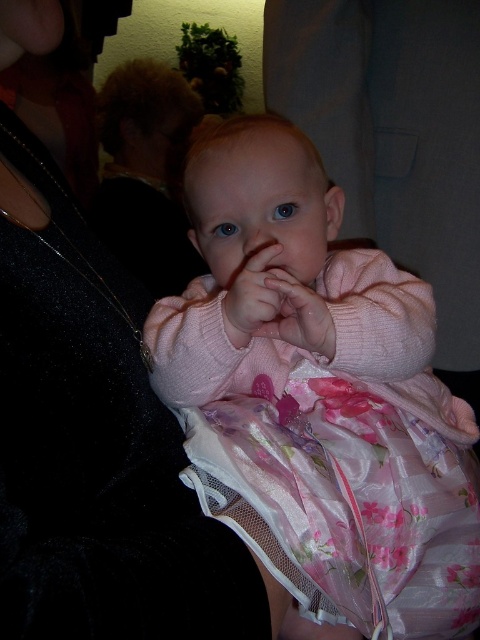
Question: Is pink satin dress at center in front of blonde hair at upper left?

Choices:
 (A) yes
 (B) no

Answer: (A)

Question: Does pink satin dress at center have a greater width compared to pink fabric hand at center?

Choices:
 (A) yes
 (B) no

Answer: (A)

Question: Does blonde hair at upper left appear on the left side of pink fabric hand at center?

Choices:
 (A) no
 (B) yes

Answer: (B)

Question: Estimate the real-world distances between objects in this image. Which object is farther from the matte black dress at upper left?

Choices:
 (A) blonde hair at upper left
 (B) pink soft fabric hand at center

Answer: (A)

Question: Which point is farther from the camera taking this photo?

Choices:
 (A) (232, 289)
 (B) (129, 387)

Answer: (A)

Question: Which point is closer to the camera?

Choices:
 (A) click(x=111, y=134)
 (B) click(x=332, y=272)
 (C) click(x=331, y=321)
 (D) click(x=137, y=404)

Answer: (D)